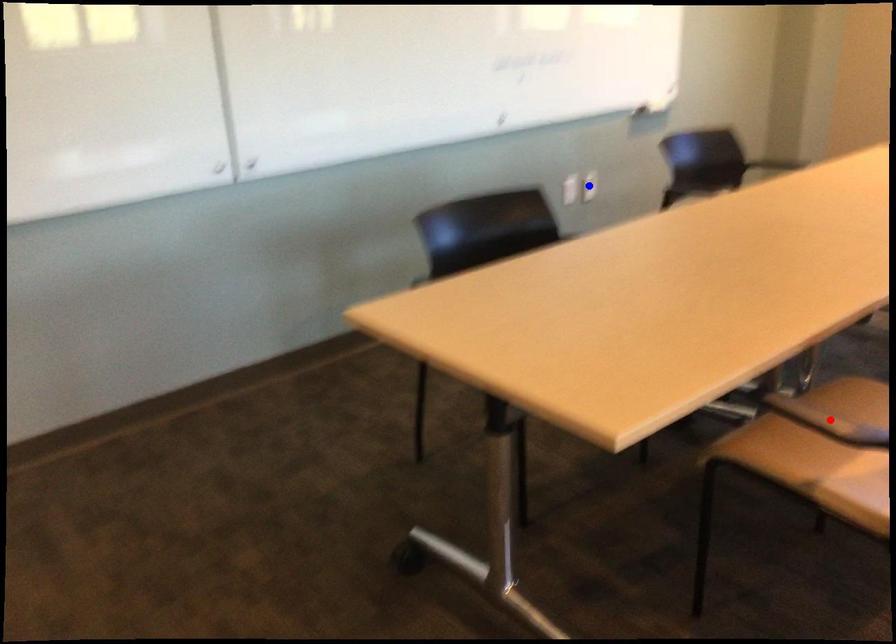
Question: Two points are marked on the image. Which point is closer to the camera?

Choices:
 (A) Blue point is closer.
 (B) Red point is closer.

Answer: (B)